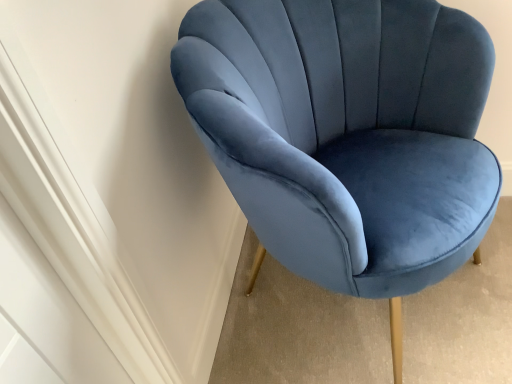
This screenshot has height=384, width=512. Describe the element at coordinates (347, 135) in the screenshot. I see `velvet blue chair at center` at that location.

The width and height of the screenshot is (512, 384). I want to click on velvet blue chair at center, so click(347, 135).

Consider the image. What is the approximate width of velvet blue chair at center?

26.19 inches.

The height and width of the screenshot is (384, 512). What are the coordinates of `velvet blue chair at center` in the screenshot? It's located at (347, 135).